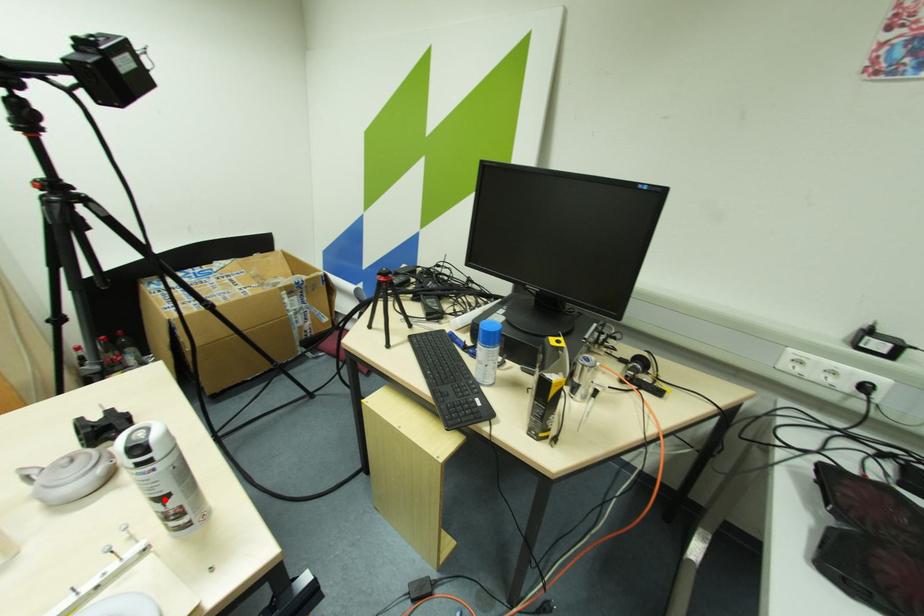
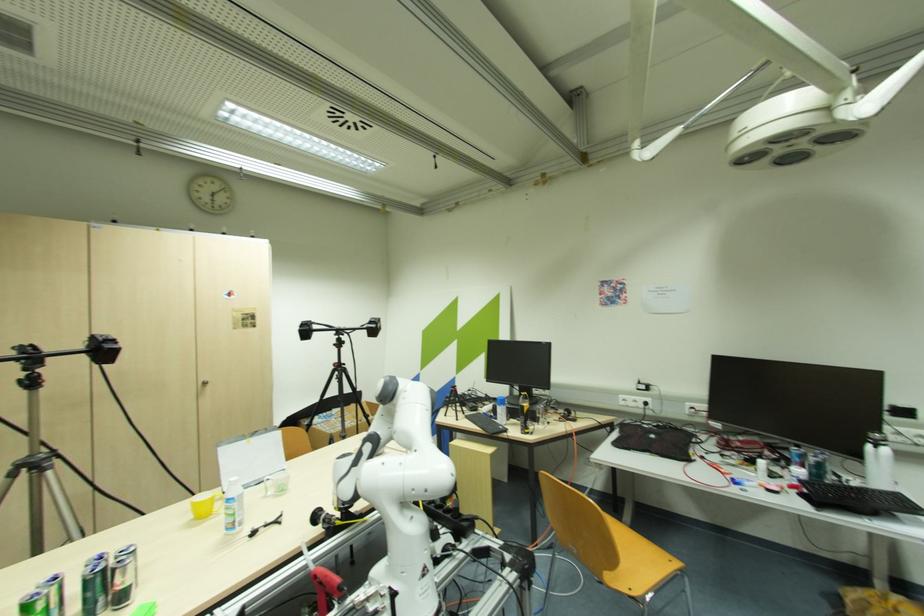
Question: I am providing you with two images of the same scene from different viewpoints. A red point is marked on the first image. At the location where the point appears in image 1, is it still visible in image 2?

Choices:
 (A) Yes
 (B) No

Answer: (B)